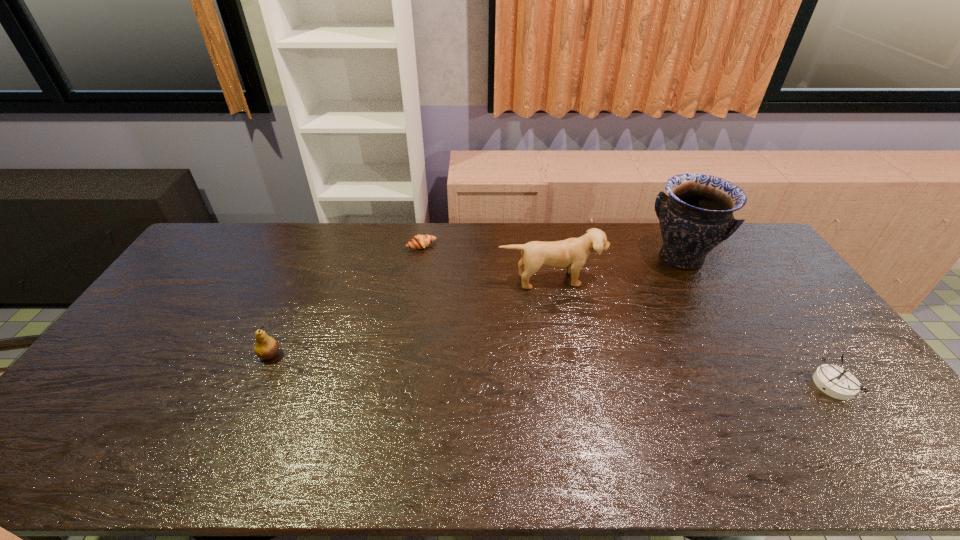
This screenshot has height=540, width=960. What are the coordinates of `vacant space located on the back of the second nearest object` in the screenshot? It's located at (307, 273).

This screenshot has height=540, width=960. Find the location of `vacant area located on the back of the rightmost object`. vacant area located on the back of the rightmost object is located at coordinates (810, 352).

Image resolution: width=960 pixels, height=540 pixels. I want to click on free spot located on the front handle of the tallest object, so click(661, 291).

Where is `free point located 0.090m on the front handle of the tallest object`? free point located 0.090m on the front handle of the tallest object is located at coordinates (661, 291).

You are a GUI agent. You are given a task and a screenshot of the screen. Output one action in this format:
    pyautogui.click(x=<x>, y=<y>)
    Task: Click on the vacant space situated on the front handle of the tallest object
    
    Given the screenshot: What is the action you would take?
    pyautogui.click(x=645, y=318)

Locate an element on the screen. free space located 0.350m on the left side of the third object from left to right is located at coordinates (587, 378).

This screenshot has height=540, width=960. In order to click on vacant space located 0.210m on the left side of the third object from left to right in this screenshot , I will do `click(573, 339)`.

Image resolution: width=960 pixels, height=540 pixels. Identify the location of vacant space located on the left side of the third object from left to right. (572, 334).

At what (x,y) coordinates should I click in order to perform the action: click on vacant region located 0.330m on the front-facing side of the fourth object from right to left. Please return your answer as a coordinate pair (x, y). The image size is (960, 540). Looking at the image, I should click on (469, 307).

At what (x,y) coordinates should I click in order to perform the action: click on free space located 0.140m on the front-facing side of the fourth object from right to left. Please return your answer as a coordinate pair (x, y). This screenshot has width=960, height=540. Looking at the image, I should click on (444, 273).